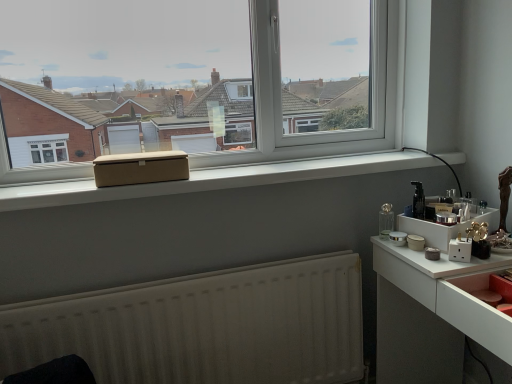
The width and height of the screenshot is (512, 384). What do you see at coordinates (418, 201) in the screenshot?
I see `black glossy bottle at right` at bounding box center [418, 201].

Where is `beige matte box at center`? This screenshot has height=384, width=512. beige matte box at center is located at coordinates (211, 179).

This screenshot has height=384, width=512. What do you see at coordinates (204, 326) in the screenshot?
I see `white matte radiator at lower center` at bounding box center [204, 326].

You are a GUI agent. You are given a task and a screenshot of the screen. Output one action in this format:
    pyautogui.click(x=<x>, y=<y>)
    Task: Click on the black glossy bottle at right
    The image size is (512, 384).
    Given the screenshot: What is the action you would take?
    pyautogui.click(x=418, y=201)

Which is behind, point (422, 219) or point (489, 213)?

Positioned behind is point (489, 213).

From the image's perspective, is black glossy bottle at right below white plastic tray at right?

Incorrect, from the image's perspective, black glossy bottle at right is higher than white plastic tray at right.

Is black glossy bottle at right beside white plastic tray at right?

No, black glossy bottle at right is not touching white plastic tray at right.

Looking at the image, does black glossy bottle at right seem bigger or smaller compared to white plastic tray at right?

Clearly, black glossy bottle at right is smaller in size than white plastic tray at right.

Between beige fabric box at center and beige matte box at center, which one is positioned behind?

beige fabric box at center is further from the camera.

Is point (143, 181) positioned before point (362, 164)?

Yes, point (143, 181) is closer to viewer.

Is there a large distance between beige fabric box at center and beige matte box at center?

No, beige fabric box at center is not far from beige matte box at center.

Can you confirm if white glossy counter at right is positioned to the right of black glossy bottle at right?

Yes, white glossy counter at right is to the right of black glossy bottle at right.

Does white glossy counter at right come in front of black glossy bottle at right?

Yes, it is.

Which of these two, white glossy counter at right or black glossy bottle at right, is bigger?

With larger size is white glossy counter at right.

Is white glossy counter at right facing towards black glossy bottle at right?

Yes, white glossy counter at right is facing black glossy bottle at right.

Is white matte radiator at lower center in contact with beige fabric box at center?

No, white matte radiator at lower center is not beside beige fabric box at center.

Which object is more forward, white matte radiator at lower center or beige fabric box at center?

white matte radiator at lower center is closer to the camera.

Would you say white matte radiator at lower center is inside or outside beige fabric box at center?

white matte radiator at lower center is spatially situated outside beige fabric box at center.

Consider the image. Can you confirm if white matte radiator at lower center is positioned to the left of beige fabric box at center?

In fact, white matte radiator at lower center is to the right of beige fabric box at center.

Which point is more forward, [325,363] or [505,332]?

Positioned in front is point [505,332].

Are white matte radiator at lower center and white glossy counter at right making contact?

No, white matte radiator at lower center is not beside white glossy counter at right.

The image size is (512, 384). Find the location of `counter above the white matte radiator at lower center (from the image's perspective)`. counter above the white matte radiator at lower center (from the image's perspective) is located at coordinates (433, 314).

From the picture: Which object is thinner, white matte radiator at lower center or white glossy counter at right?

white matte radiator at lower center.

Is point (476, 215) more distant than point (414, 181)?

No, (476, 215) is closer to viewer.

From a real-world perspective, is white plastic tray at right over black glossy bottle at right?

Actually, white plastic tray at right is physically below black glossy bottle at right in the real world.

Is white plastic tray at right to the left or to the right of black glossy bottle at right in the image?

Clearly, white plastic tray at right is on the right of black glossy bottle at right in the image.

In terms of width, does white plastic tray at right look wider or thinner when compared to black glossy bottle at right?

Clearly, white plastic tray at right has more width compared to black glossy bottle at right.

Would you consider white matte radiator at lower center to be distant from matte pink drawer at lower right?

No, white matte radiator at lower center is in close proximity to matte pink drawer at lower right.

How different are the orientations of white matte radiator at lower center and matte pink drawer at lower right in degrees?

The facing directions of white matte radiator at lower center and matte pink drawer at lower right are 91.1 degrees apart.

From a real-world perspective, is white matte radiator at lower center under matte pink drawer at lower right?

Correct, in the physical world, white matte radiator at lower center is lower than matte pink drawer at lower right.

Which of these two, white matte radiator at lower center or matte pink drawer at lower right, stands taller?

white matte radiator at lower center.

Locate an element on the screen. This screenshot has width=512, height=384. appliance on the left side of white plastic tray at right is located at coordinates (418, 201).

The width and height of the screenshot is (512, 384). Identify the location of window sill below the beige fabric box at center (from the image's perspective). (211, 179).

Based on their spatial positions, is white matte radiator at lower center or beige fabric box at center closer to matte pink drawer at lower right?

white matte radiator at lower center.

Based on the photo, when comparing their distances from beige matte box at center, does white glossy counter at right or beige fabric box at center seem further?

white glossy counter at right.

Based on their spatial positions, is beige matte box at center or white plastic tray at right closer to black glossy bottle at right?

Based on the image, white plastic tray at right appears to be nearer to black glossy bottle at right.

Looking at this image, considering their positions, is matte pink drawer at lower right positioned further to white glossy counter at right than beige fabric box at center?

Among the two, beige fabric box at center is located further to white glossy counter at right.

Considering their positions, is white plastic tray at right positioned closer to white matte radiator at lower center than beige fabric box at center?

beige fabric box at center is closer to white matte radiator at lower center.

Which object lies further to the anchor point white plastic tray at right, beige fabric box at center or beige matte box at center?

beige fabric box at center.

From the image, which object appears to be nearer to matte pink drawer at lower right, white plastic tray at right or beige matte box at center?

white plastic tray at right lies closer to matte pink drawer at lower right than the other object.

Estimate the real-world distances between objects in this image. Which object is closer to white matte radiator at lower center, white glossy counter at right or white plastic tray at right?

Based on the image, white glossy counter at right appears to be nearer to white matte radiator at lower center.

Where is `shelf between white matte radiator at lower center and matte pink drawer at lower right from left to right`? This screenshot has width=512, height=384. shelf between white matte radiator at lower center and matte pink drawer at lower right from left to right is located at coordinates (443, 227).

I want to click on shelf between matte pink drawer at lower right and black glossy bottle at right along the z-axis, so click(x=443, y=227).

Where is `radiator between beige fabric box at center and matte pink drawer at lower right in the horizontal direction`? The width and height of the screenshot is (512, 384). radiator between beige fabric box at center and matte pink drawer at lower right in the horizontal direction is located at coordinates (204, 326).

Locate an element on the screen. appliance situated between white matte radiator at lower center and white glossy counter at right from left to right is located at coordinates (418, 201).